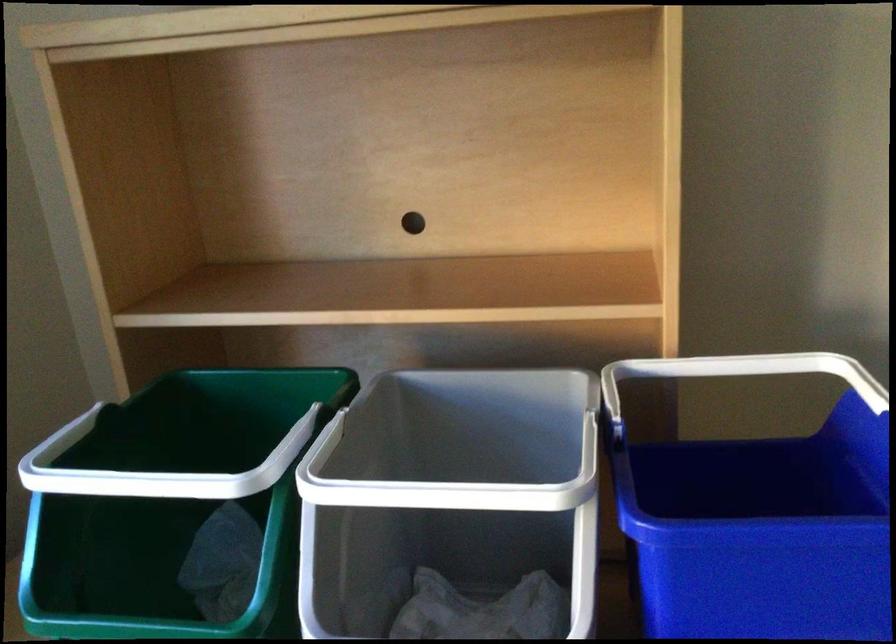
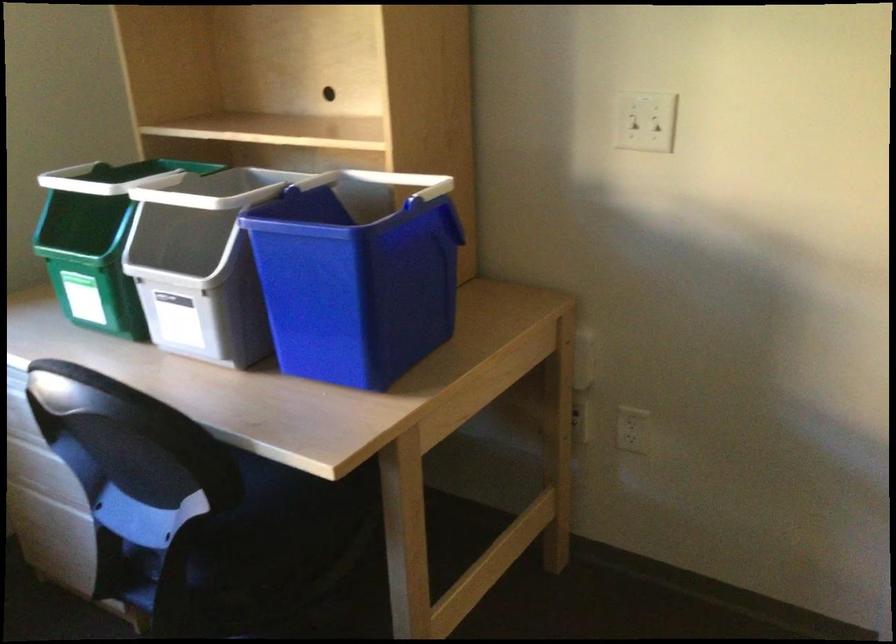
In the second image, find the point that corresponds to pixel 391 404 in the first image.

(245, 185)